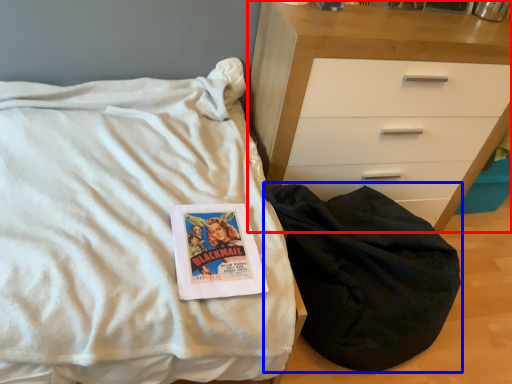
Question: Which of the following is the closest to the observer, chest of drawers (highlighted by a red box) or sleeping bag (highlighted by a blue box)?

Choices:
 (A) chest of drawers
 (B) sleeping bag

Answer: (B)